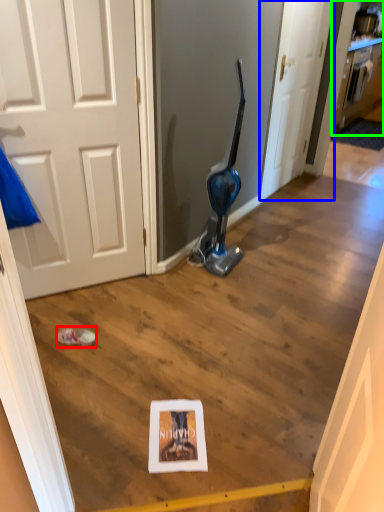
Question: Estimate the real-world distances between objects in this image. Which object is closer to footwear (highlighted by a red box), door (highlighted by a blue box) or cabinetry (highlighted by a green box)?

Choices:
 (A) door
 (B) cabinetry

Answer: (A)